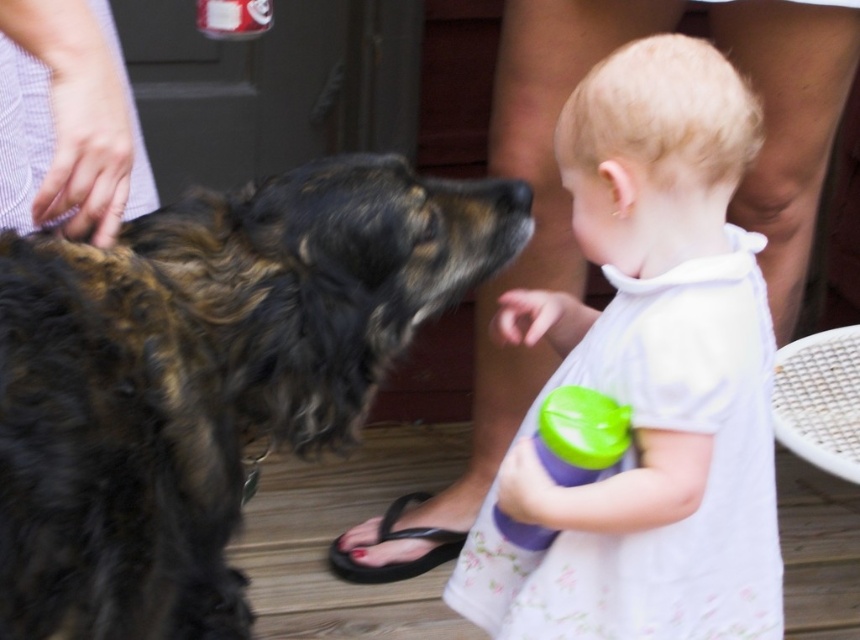
Does white floral dress at center appear under black rubber sandal at lower center?

Incorrect, white floral dress at center is not positioned below black rubber sandal at lower center.

Is white floral dress at center thinner than black rubber sandal at lower center?

Incorrect, white floral dress at center's width is not less than black rubber sandal at lower center's.

Which is behind, point (642, 572) or point (452, 550)?

Positioned behind is point (452, 550).

Identify the location of white floral dress at center. The width and height of the screenshot is (860, 640). (647, 376).

Does shaggy brown fur at center lie in front of white floral dress at center?

That is True.

Which is above, shaggy brown fur at center or white floral dress at center?

Positioned higher is shaggy brown fur at center.

Between point (69, 540) and point (689, 310), which one is positioned in front?

Point (69, 540) is more forward.

Identify the location of shaggy brown fur at center. (206, 376).

Between shaggy brown fur at center and green plastic sippy cup at lower center, which one appears on the right side from the viewer's perspective?

green plastic sippy cup at lower center

In the scene shown: Can you confirm if shaggy brown fur at center is positioned to the right of green plastic sippy cup at lower center?

In fact, shaggy brown fur at center is to the left of green plastic sippy cup at lower center.

Is point (102, 440) positioned before point (594, 413)?

Yes, it is in front of point (594, 413).

You are a GUI agent. You are given a task and a screenshot of the screen. Output one action in this format:
    pyautogui.click(x=<x>, y=<y>)
    Task: Click on the shaggy brown fur at center
    
    Given the screenshot: What is the action you would take?
    pyautogui.click(x=206, y=376)